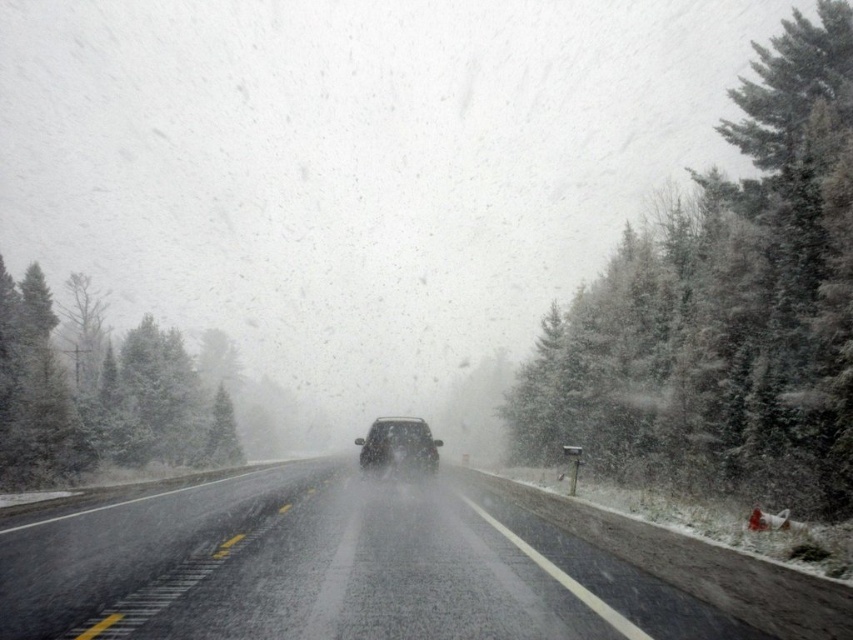
You are driving a car and want to overtake the sleek black suv at center. The glossy asphalt highway at center has two lanes. Can you safely overtake the suv using the other lane?

The glossy asphalt highway at center is 7.00 meters away from the sleek black suv at center, so you can safely overtake the suv using the other lane as there is enough distance between your car and the suv.